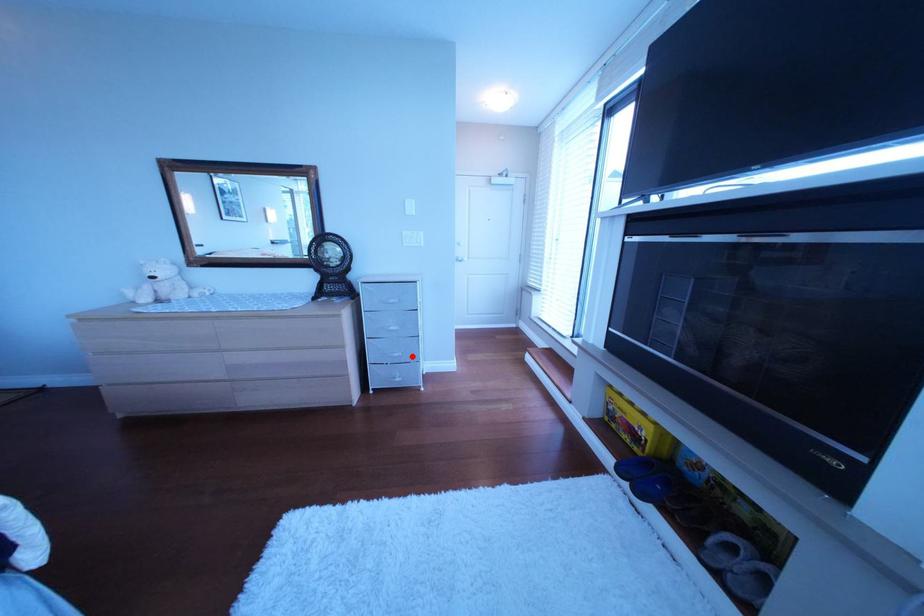
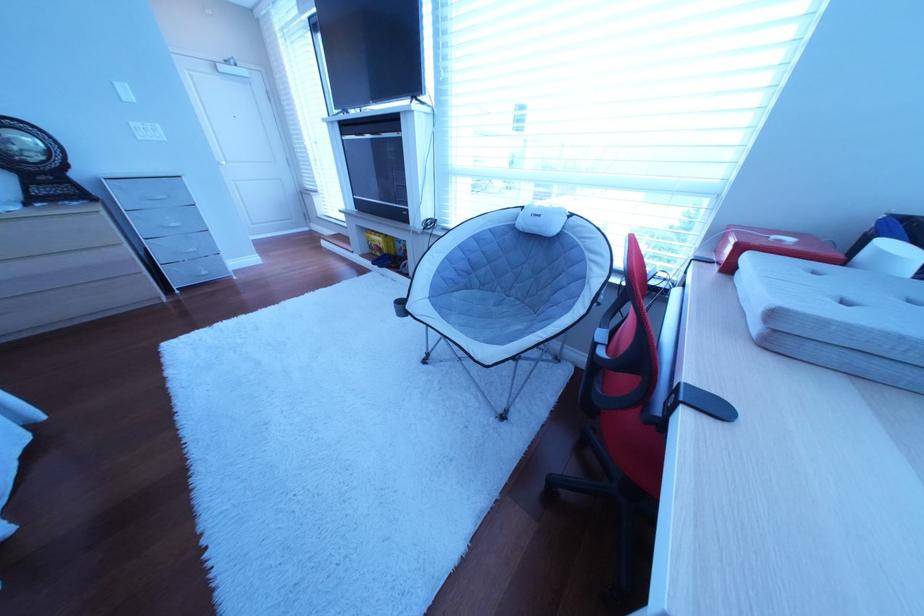
Question: I am providing you with two images of the same scene from different viewpoints. A red point is shown in image1. For the corresponding object point in image2, is it positioned nearer or farther from the camera?

Choices:
 (A) Nearer
 (B) Farther

Answer: (A)